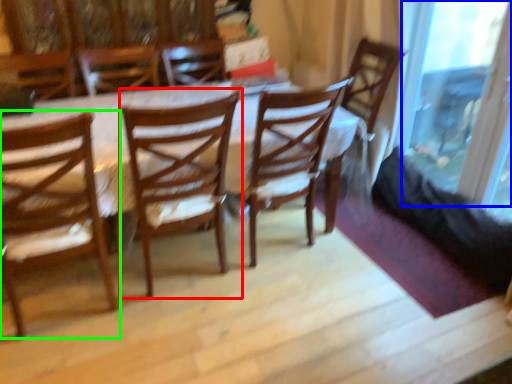
Question: Estimate the real-world distances between objects in this image. Which object is farther from chair (highlighted by a red box), glass door (highlighted by a blue box) or chair (highlighted by a green box)?

Choices:
 (A) glass door
 (B) chair

Answer: (A)